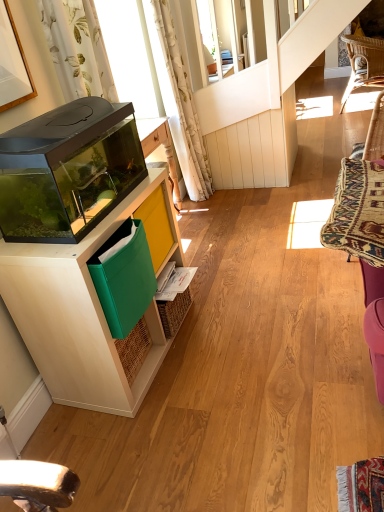
Question: Would you say green fabric folder at lower left is outside woven wicker swivel chair at right?

Choices:
 (A) no
 (B) yes

Answer: (B)

Question: Is green fabric folder at lower left not close to woven wicker swivel chair at right?

Choices:
 (A) yes
 (B) no

Answer: (B)

Question: Can you confirm if green fabric folder at lower left is thinner than woven wicker swivel chair at right?

Choices:
 (A) no
 (B) yes

Answer: (B)

Question: Is woven wicker swivel chair at right completely or partially inside green fabric folder at lower left?

Choices:
 (A) yes
 (B) no

Answer: (B)

Question: Considering the relative sizes of green fabric folder at lower left and woven wicker swivel chair at right in the image provided, is green fabric folder at lower left shorter than woven wicker swivel chair at right?

Choices:
 (A) no
 (B) yes

Answer: (B)

Question: Is green fabric folder at lower left further to the viewer compared to woven wicker swivel chair at right?

Choices:
 (A) no
 (B) yes

Answer: (A)

Question: Is white wood cabinet at left taller than woven rattan chair at upper right?

Choices:
 (A) yes
 (B) no

Answer: (B)

Question: Is white wood cabinet at left oriented towards woven rattan chair at upper right?

Choices:
 (A) no
 (B) yes

Answer: (A)

Question: Is woven rattan chair at upper right completely or partially inside white wood cabinet at left?

Choices:
 (A) no
 (B) yes

Answer: (A)

Question: Is white wood cabinet at left far away from woven rattan chair at upper right?

Choices:
 (A) no
 (B) yes

Answer: (B)

Question: Considering the relative positions of white wood cabinet at left and woven rattan chair at upper right in the image provided, is white wood cabinet at left to the right of woven rattan chair at upper right from the viewer's perspective?

Choices:
 (A) yes
 (B) no

Answer: (B)

Question: Considering the relative positions of white wood cabinet at left and woven rattan chair at upper right in the image provided, is white wood cabinet at left to the left of woven rattan chair at upper right from the viewer's perspective?

Choices:
 (A) no
 (B) yes

Answer: (B)

Question: Is white wood cabinet at left positioned before white floral fabric curtain at upper left, arranged as the 1th curtain when viewed from the left?

Choices:
 (A) yes
 (B) no

Answer: (A)